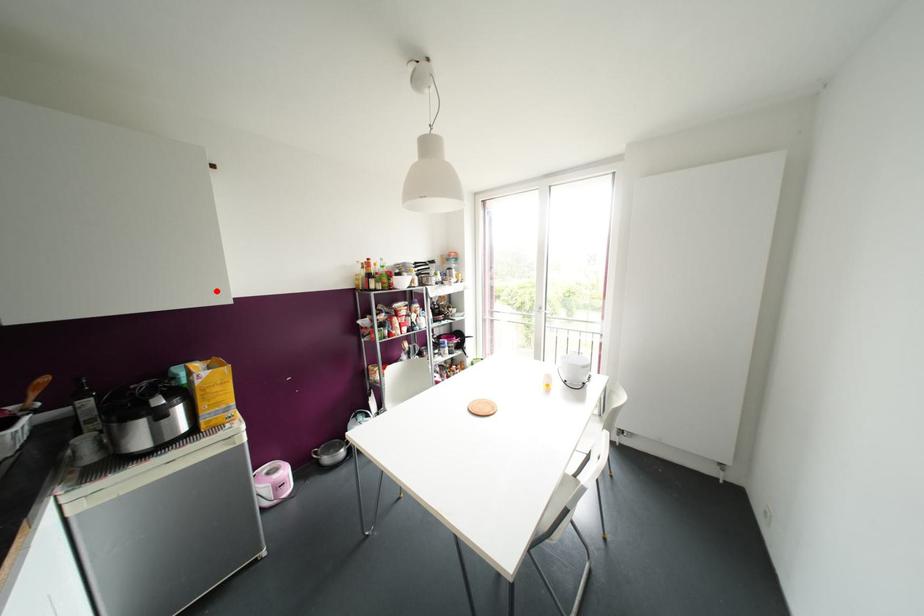
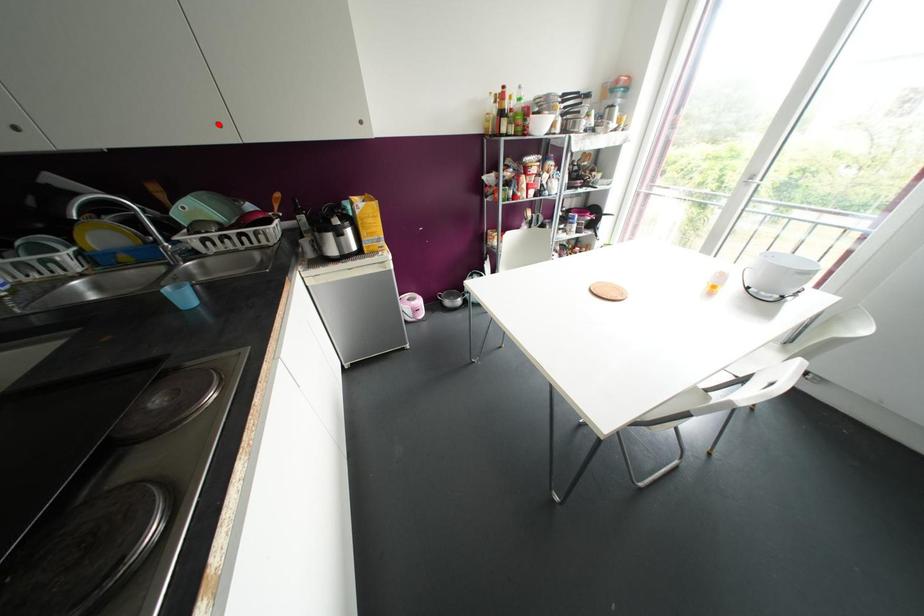
I am providing you with two images of the same scene from different viewpoints. A red point is marked on the first image and another point is marked on the second image. Is the red point in image1 aligned with the point shown in image2?

No